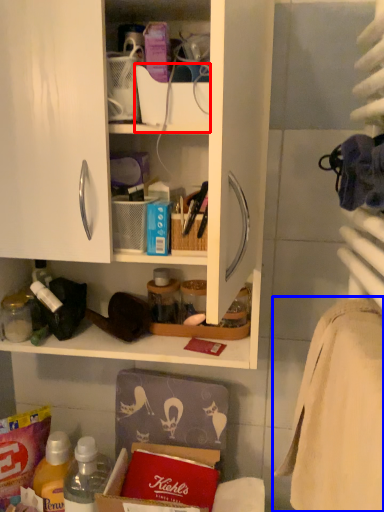
Question: Which of the following is the closest to the observer, box (highlighted by a red box) or bath towel (highlighted by a blue box)?

Choices:
 (A) box
 (B) bath towel

Answer: (B)